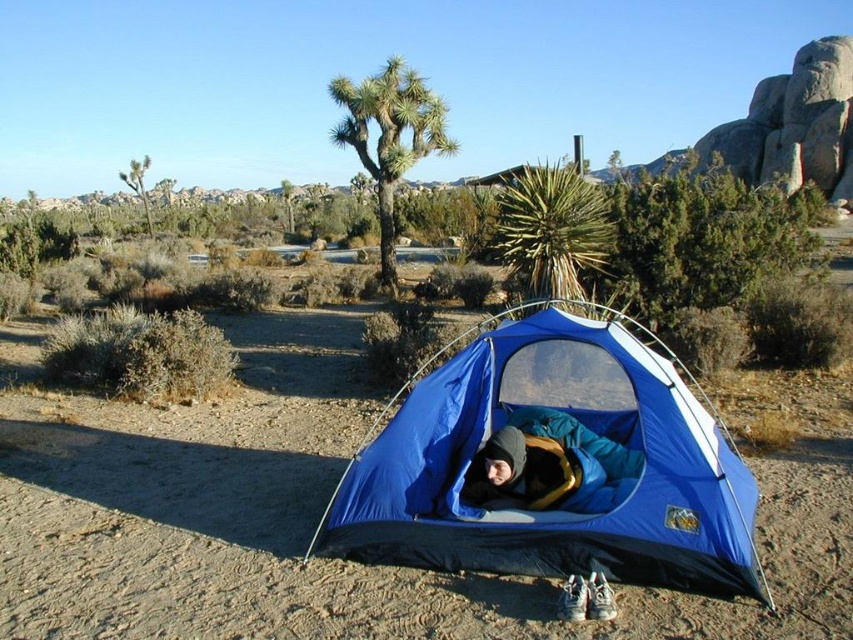
You are a hiker who just arrived at the campsite and need to set up your sleeping bag. Based on the scene, where should you place your blue fabric sleeping bag at center in relation to the blue fabric tent at center?

You should place the blue fabric sleeping bag at center to the right of the blue fabric tent at center because the blue fabric tent at center is already positioned to the left of the blue fabric sleeping bag at center in the scene.

You are a camper who just arrived at the desert campsite. You see the blue fabric tent at center and the blue fabric sleeping bag at center. Which one is closer to you?

The blue fabric tent at center is closer to you because it is in front of the blue fabric sleeping bag at center.

You are a camper who wants to place a small backpack between the blue fabric tent at center and the blue fabric sleeping bag at center. Can you fit the backpack in the space between them?

The blue fabric tent at center is 9.07 inches away from the blue fabric sleeping bag at center. If the backpack requires more than 9.07 inches of space, it won